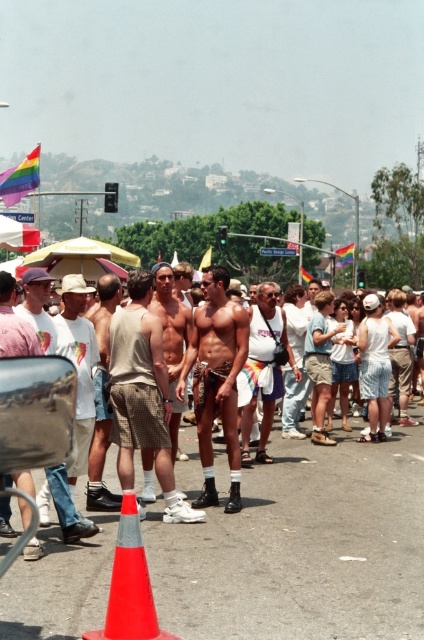
How much distance is there between tan shorts at center and white fabric shorts at center?

tan shorts at center is 5.03 feet from white fabric shorts at center.

Is point (128, 477) positioned in front of point (264, 422)?

Yes, it is.

The height and width of the screenshot is (640, 424). What are the coordinates of `tan shorts at center` in the screenshot? It's located at (142, 394).

The image size is (424, 640). I want to click on tan shorts at center, so click(x=142, y=394).

How far apart are brown leather belt at center and white matte t-shirt at center?

brown leather belt at center and white matte t-shirt at center are 5.76 feet apart.

Does brown leather belt at center have a lesser height compared to white matte t-shirt at center?

Yes.

At what (x,y) coordinates should I click in order to perform the action: click on brown leather belt at center. Please return your answer as a coordinate pair (x, y). Looking at the image, I should click on (215, 380).

Is point (131, 595) closer to camera compared to point (257, 356)?

Yes, point (131, 595) is closer to viewer.

Which of these two, orange plastic traffic cone at lower center or white fabric shorts at center, stands shorter?

Standing shorter between the two is orange plastic traffic cone at lower center.

Identify the location of orange plastic traffic cone at lower center. (130, 584).